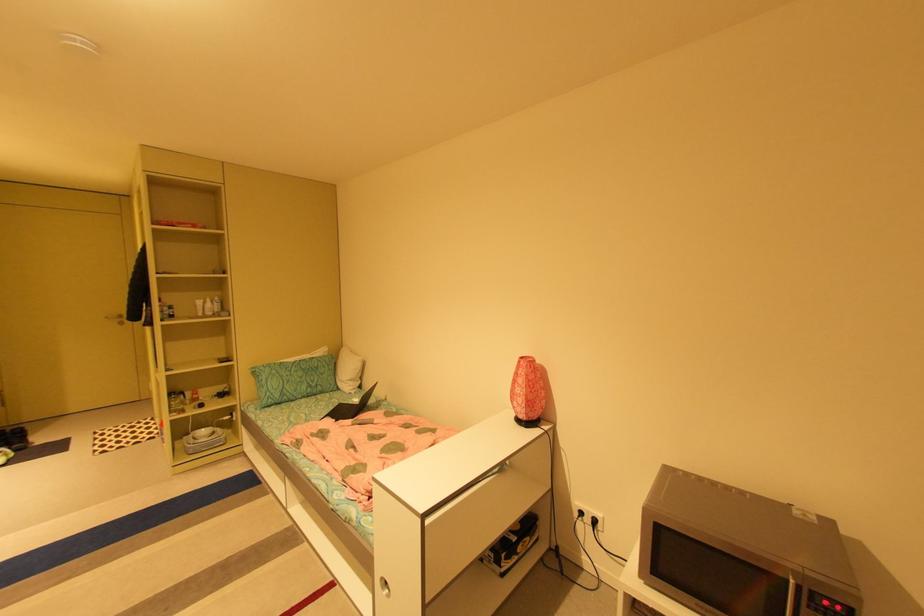
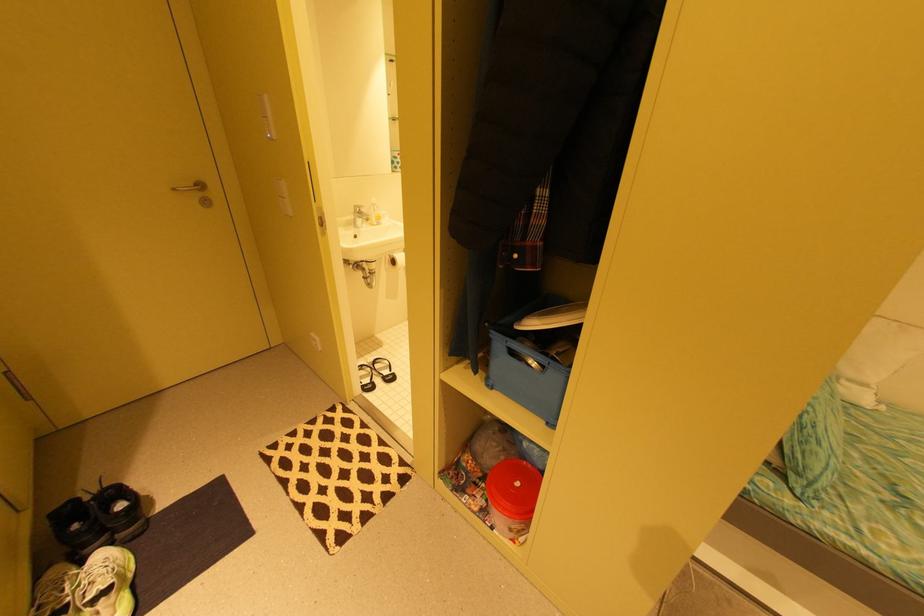
In a continuous first-person perspective shot, in which direction is the camera moving?

The cameraman moved toward left, forward.